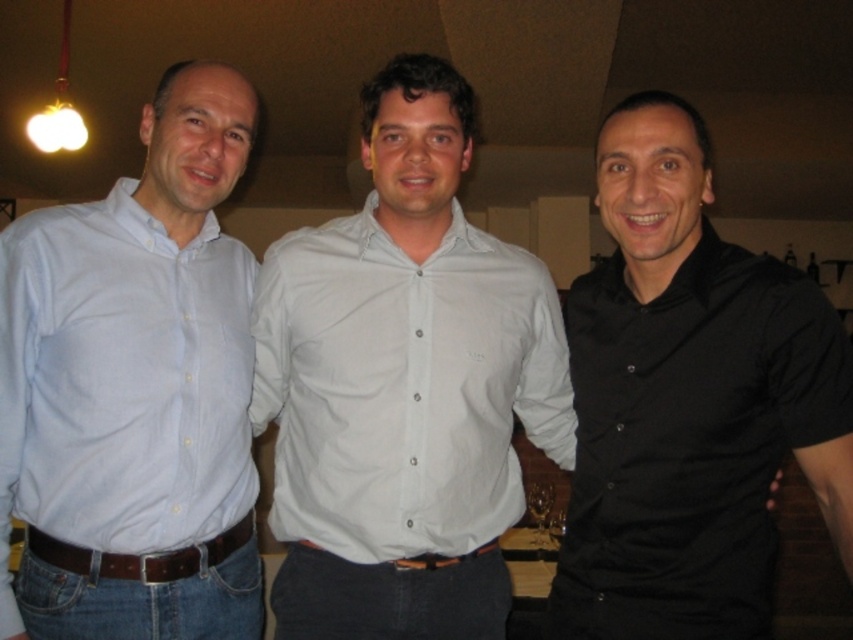
You are standing in the room and want to hand a gift to the person wearing the white cotton shirt at center. Which direction should you move to approach them?

The white cotton shirt at center is located at point (404, 387), so you should move towards the center of the room to reach them.

Based on the photo, you are standing in the room and want to hand a gift to the person wearing the black matte shirt at right. Based on their position in the image, which direction should you move to approach them?

The black matte shirt at right is located at point 0.628 on the x axis and 0.808 on the y axis. Since the coordinate system typically places the origin at the bottom left corner, moving towards the right and slightly upwards would bring you closer to the black matte shirt at right.